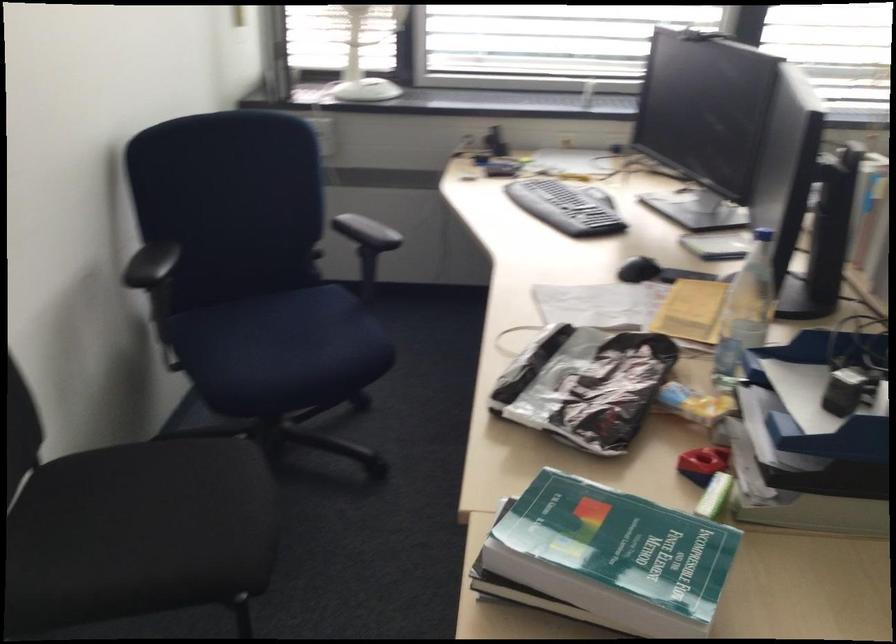
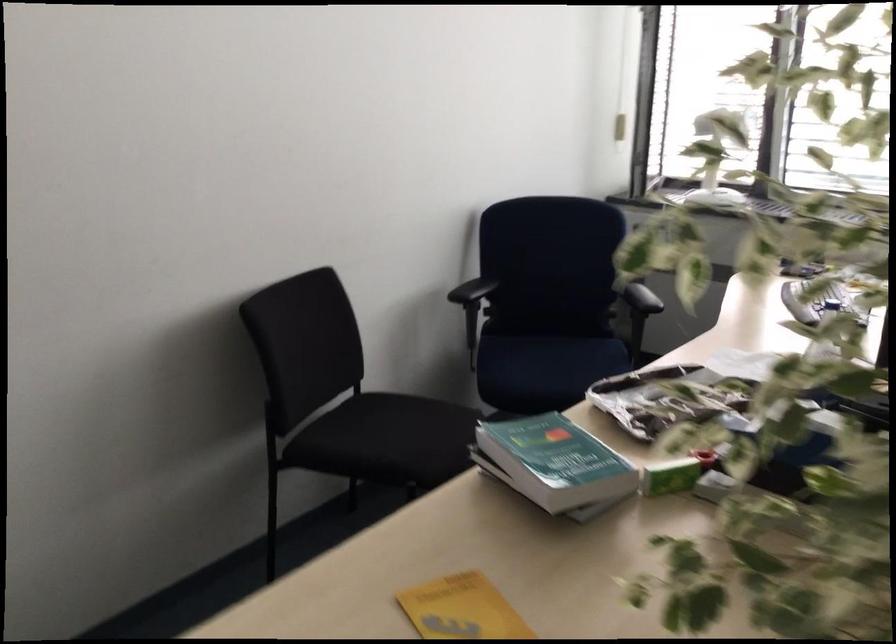
In the second image, find the point that corresponds to point 634,552 in the first image.

(554, 462)